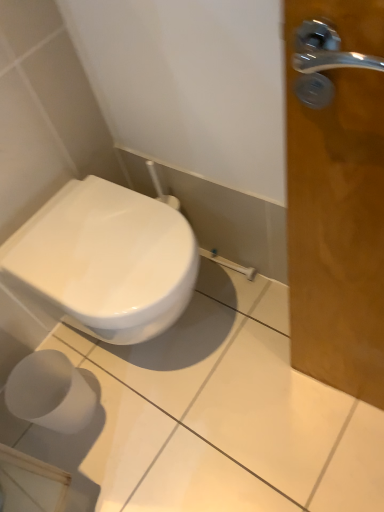
What is the approximate height of white matte toilet paper at lower left?

white matte toilet paper at lower left is 9.64 inches tall.

What do you see at coordinates (50, 392) in the screenshot? I see `white matte toilet paper at lower left` at bounding box center [50, 392].

Identify the location of white matte toilet paper at lower left. This screenshot has height=512, width=384. (50, 392).

Describe the element at coordinates (105, 261) in the screenshot. The height and width of the screenshot is (512, 384). I see `white glossy toilet at lower left` at that location.

Identify the location of white glossy toilet at lower left. This screenshot has width=384, height=512. (105, 261).

Find the location of a particular element. Image resolution: width=384 pixels, height=512 pixels. white matte toilet paper at lower left is located at coordinates (50, 392).

Is white matte toilet paper at lower left at the right side of white glossy toilet at lower left?

Incorrect, white matte toilet paper at lower left is not on the right side of white glossy toilet at lower left.

Which object is closer to the camera taking this photo, white matte toilet paper at lower left or white glossy toilet at lower left?

white glossy toilet at lower left.

Which point is more distant from viewer, (47, 417) or (147, 264)?

Positioned behind is point (47, 417).

Consider the image. From the image's perspective, which object appears higher, white matte toilet paper at lower left or white glossy toilet at lower left?

white glossy toilet at lower left.

From a real-world perspective, is white matte toilet paper at lower left physically located above or below white glossy toilet at lower left?

Clearly, from a real-world perspective, white matte toilet paper at lower left is below white glossy toilet at lower left.

Between white matte toilet paper at lower left and white glossy toilet at lower left, which one has smaller width?

white matte toilet paper at lower left is thinner.

Is white matte toilet paper at lower left shorter than white glossy toilet at lower left?

Yes, white matte toilet paper at lower left is shorter than white glossy toilet at lower left.

Which of these two, white matte toilet paper at lower left or white glossy toilet at lower left, is smaller?

white matte toilet paper at lower left is smaller.

Can we say white matte toilet paper at lower left lies outside white glossy toilet at lower left?

Yes, white matte toilet paper at lower left is outside of white glossy toilet at lower left.

Is white matte toilet paper at lower left far from white glossy toilet at lower left?

No, white matte toilet paper at lower left is not far from white glossy toilet at lower left.

Is white glossy toilet at lower left at the back of white matte toilet paper at lower left?

white matte toilet paper at lower left is not turned away from white glossy toilet at lower left.

How many degrees apart are the facing directions of white matte toilet paper at lower left and white glossy toilet at lower left?

The facing directions of white matte toilet paper at lower left and white glossy toilet at lower left are 1.16 degrees apart.

Where is `toilet on the right of white matte toilet paper at lower left`? The width and height of the screenshot is (384, 512). toilet on the right of white matte toilet paper at lower left is located at coordinates (105, 261).

Is white glossy toilet at lower left at the right side of white matte toilet paper at lower left?

Indeed, white glossy toilet at lower left is positioned on the right side of white matte toilet paper at lower left.

Does white glossy toilet at lower left lie in front of white matte toilet paper at lower left?

Yes, white glossy toilet at lower left is in front of white matte toilet paper at lower left.

Is point (66, 229) farther from viewer compared to point (31, 375)?

No, it is in front of (31, 375).

From the image's perspective, which one is positioned lower, white glossy toilet at lower left or white matte toilet paper at lower left?

From the image's view, white matte toilet paper at lower left is below.

From a real-world perspective, which is physically above, white glossy toilet at lower left or white matte toilet paper at lower left?

white glossy toilet at lower left, from a real-world perspective.

Does white glossy toilet at lower left have a greater width compared to white matte toilet paper at lower left?

Correct, the width of white glossy toilet at lower left exceeds that of white matte toilet paper at lower left.

Considering the relative sizes of white glossy toilet at lower left and white matte toilet paper at lower left in the image provided, is white glossy toilet at lower left taller than white matte toilet paper at lower left?

Yes, white glossy toilet at lower left is taller than white matte toilet paper at lower left.

Considering the relative sizes of white glossy toilet at lower left and white matte toilet paper at lower left in the image provided, is white glossy toilet at lower left bigger than white matte toilet paper at lower left?

Indeed, white glossy toilet at lower left has a larger size compared to white matte toilet paper at lower left.

Is white glossy toilet at lower left situated inside white matte toilet paper at lower left or outside?

white glossy toilet at lower left lies outside white matte toilet paper at lower left.

Is white glossy toilet at lower left placed right next to white matte toilet paper at lower left?

white glossy toilet at lower left and white matte toilet paper at lower left are clearly separated.

Consider the image. Is white glossy toilet at lower left turned away from white matte toilet paper at lower left?

No, white glossy toilet at lower left is not facing the opposite direction of white matte toilet paper at lower left.

What's the angular difference between white glossy toilet at lower left and white matte toilet paper at lower left's facing directions?

The angle between the facing direction of white glossy toilet at lower left and the facing direction of white matte toilet paper at lower left is 1.16 degrees.

How much distance is there between white glossy toilet at lower left and white matte toilet paper at lower left?

The distance of white glossy toilet at lower left from white matte toilet paper at lower left is 17.26 inches.

At what (x,y) coordinates should I click in order to perform the action: click on toilet lying on the right of white matte toilet paper at lower left. Please return your answer as a coordinate pair (x, y). Looking at the image, I should click on (105, 261).

Locate an element on the screen. toilet above the white matte toilet paper at lower left (from a real-world perspective) is located at coordinates (105, 261).

The height and width of the screenshot is (512, 384). Find the location of `toilet on the right of the white matte toilet paper at lower left`. toilet on the right of the white matte toilet paper at lower left is located at coordinates (105, 261).